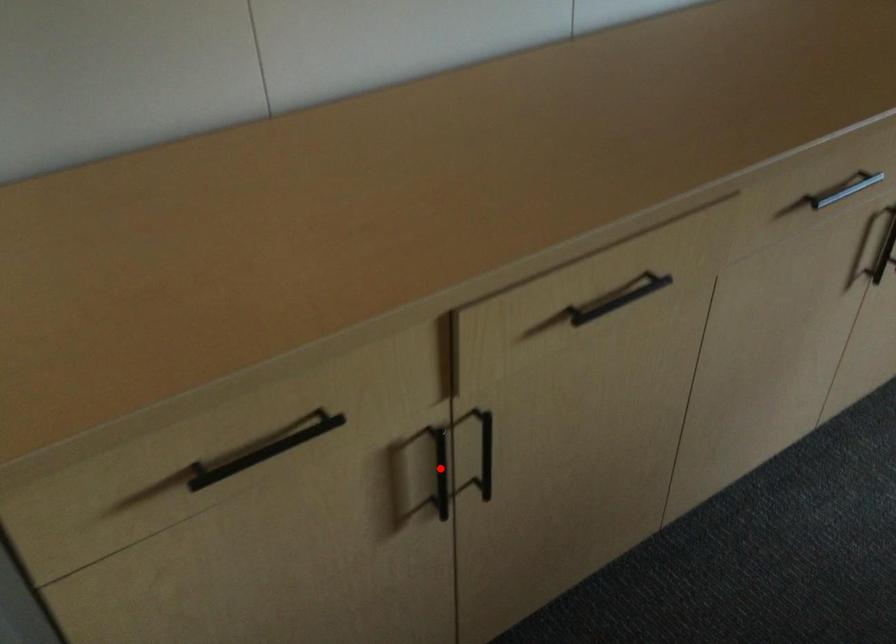
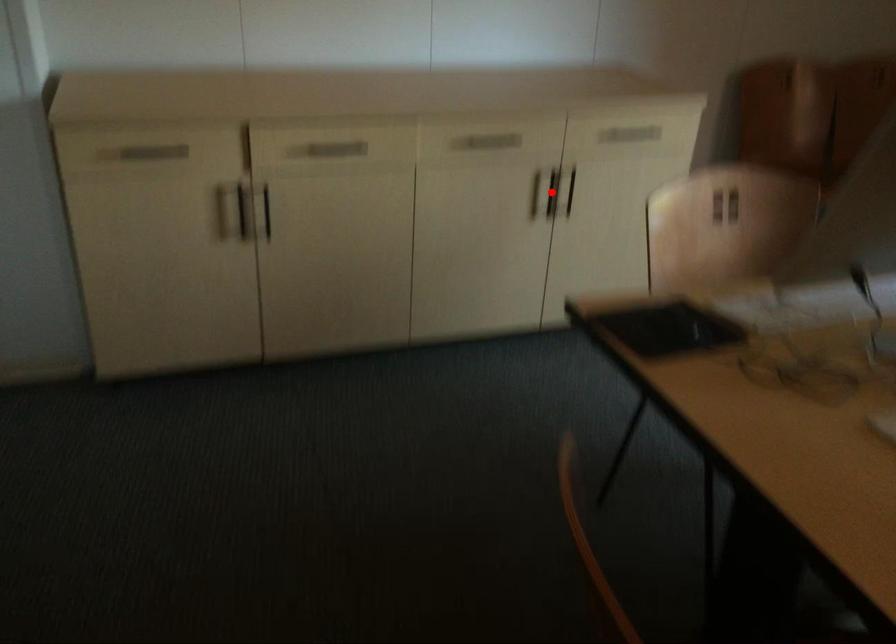
Consider the image. I am providing you with two images of the same scene from different viewpoints. A red point is marked on the first image and another point is marked on the second image. Are the points marked in image1 and image2 representing the same 3D position?

No